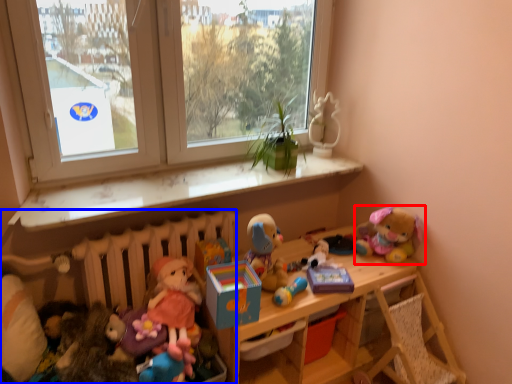
Question: Which object appears farthest to the camera in this image, toy (highlighted by a red box) or radiator (highlighted by a blue box)?

Choices:
 (A) toy
 (B) radiator

Answer: (A)